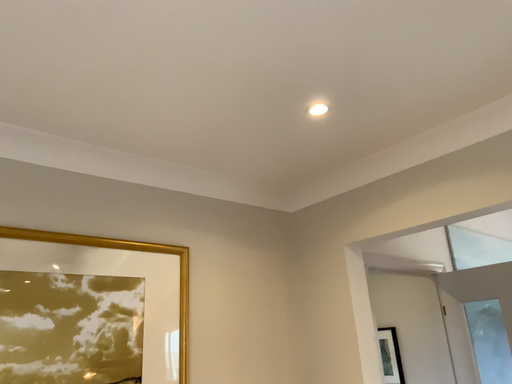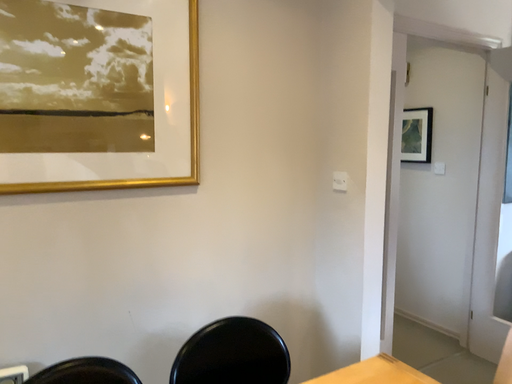
Question: Which way did the camera rotate in the video?

Choices:
 (A) rotated right
 (B) rotated left

Answer: (B)